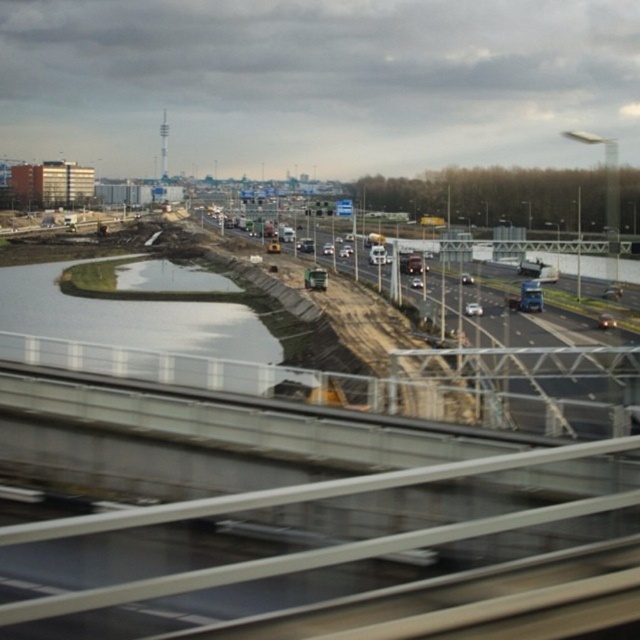
Does point (304, 292) lie in front of point (136, 321)?

That is False.

Is concrete asphalt highway at center closer to camera compared to smooth concrete water at lower left?

That is True.

Who is more forward, (531, 371) or (257, 337)?

Point (531, 371) is in front.

Locate an element on the screen. concrete asphalt highway at center is located at coordinates (461, 364).